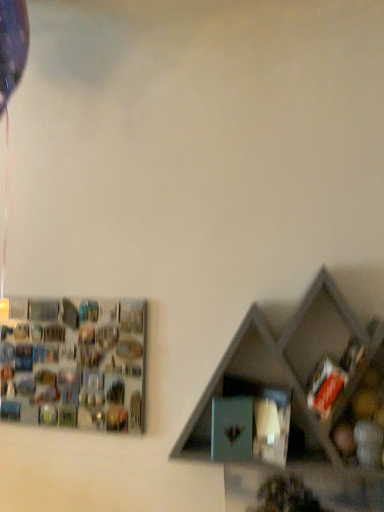
Question: Considering the relative sizes of matte gray shelf at lower right, arranged as the 1th shelf when viewed from the right, and metallic silver frame at upper left, the 1th shelf from the back, in the image provided, is matte gray shelf at lower right, arranged as the 1th shelf when viewed from the right, thinner than metallic silver frame at upper left, the 1th shelf from the back,?

Choices:
 (A) no
 (B) yes

Answer: (A)

Question: From a real-world perspective, is matte gray shelf at lower right, which appears as the second shelf when viewed from the back, below metallic silver frame at upper left, which is the second shelf from right to left?

Choices:
 (A) no
 (B) yes

Answer: (A)

Question: Is matte gray shelf at lower right, arranged as the 1th shelf when viewed from the right, turned away from metallic silver frame at upper left, placed as the 2th shelf when sorted from front to back?

Choices:
 (A) no
 (B) yes

Answer: (A)

Question: Considering the relative sizes of matte gray shelf at lower right, the 1th shelf when ordered from front to back, and metallic silver frame at upper left, the 1th shelf from the back, in the image provided, is matte gray shelf at lower right, the 1th shelf when ordered from front to back, smaller than metallic silver frame at upper left, the 1th shelf from the back,?

Choices:
 (A) no
 (B) yes

Answer: (A)

Question: Is matte gray shelf at lower right, which is the second shelf from left to right, wider than metallic silver frame at upper left, which is the 1th shelf from left to right?

Choices:
 (A) no
 (B) yes

Answer: (B)

Question: Is there a large distance between matte gray shelf at lower right, which appears as the second shelf when viewed from the back, and metallic silver frame at upper left, which is the 1th shelf from left to right?

Choices:
 (A) no
 (B) yes

Answer: (A)

Question: Is metallic silver frame at upper left, the 1th shelf from the back, facing away from matte gray shelf at lower right, arranged as the 1th shelf when viewed from the right?

Choices:
 (A) no
 (B) yes

Answer: (A)

Question: Would you consider metallic silver frame at upper left, placed as the 2th shelf when sorted from front to back, to be distant from matte gray shelf at lower right, which appears as the second shelf when viewed from the back?

Choices:
 (A) no
 (B) yes

Answer: (A)

Question: Can you confirm if metallic silver frame at upper left, which is the 1th shelf from left to right, is wider than matte gray shelf at lower right, arranged as the 1th shelf when viewed from the right?

Choices:
 (A) yes
 (B) no

Answer: (B)

Question: Can you confirm if metallic silver frame at upper left, placed as the 2th shelf when sorted from front to back, is smaller than matte gray shelf at lower right, which appears as the second shelf when viewed from the back?

Choices:
 (A) yes
 (B) no

Answer: (A)

Question: Considering the relative sizes of metallic silver frame at upper left, which is the 1th shelf from left to right, and matte gray shelf at lower right, arranged as the 1th shelf when viewed from the right, in the image provided, is metallic silver frame at upper left, which is the 1th shelf from left to right, thinner than matte gray shelf at lower right, arranged as the 1th shelf when viewed from the right,?

Choices:
 (A) yes
 (B) no

Answer: (A)

Question: Is metallic silver frame at upper left, which is the second shelf from right to left, positioned beyond the bounds of matte gray shelf at lower right, arranged as the 1th shelf when viewed from the right?

Choices:
 (A) no
 (B) yes

Answer: (B)

Question: Is matte gray shelf at lower right, which is the second shelf from left to right, inside the boundaries of metallic silver frame at upper left, placed as the 2th shelf when sorted from front to back, or outside?

Choices:
 (A) inside
 (B) outside

Answer: (B)